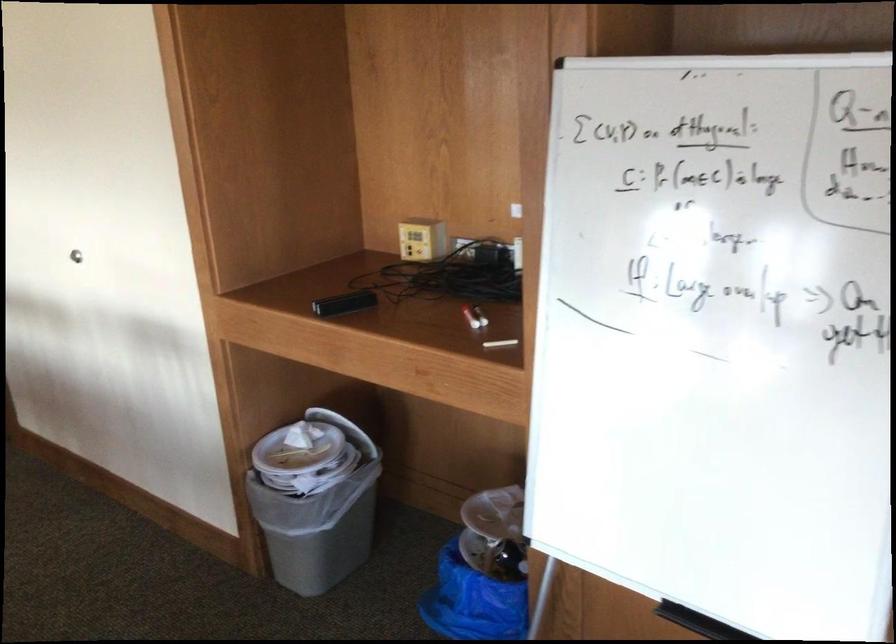
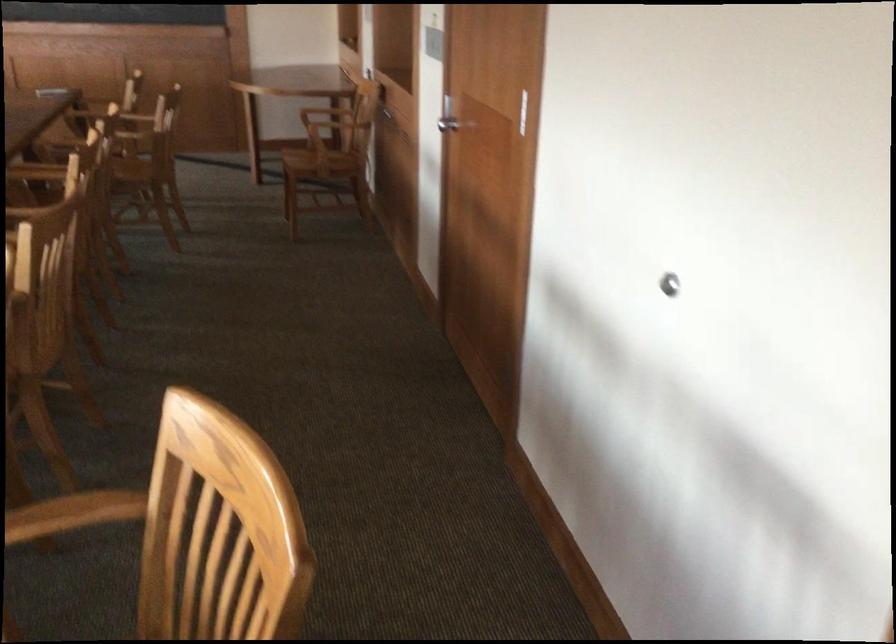
The point at (73,254) is marked in the first image. Where is the corresponding point in the second image?

(669, 283)